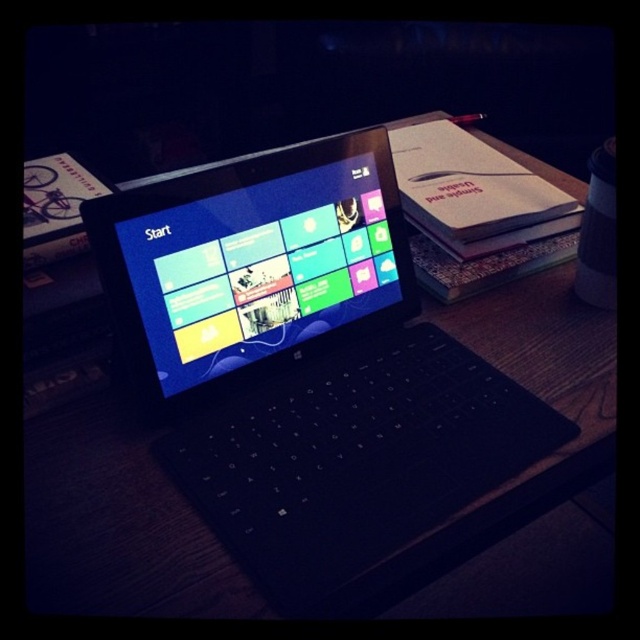
Who is higher up, black matte laptop at center or matte plastic screen at center?

matte plastic screen at center

What do you see at coordinates (304, 364) in the screenshot?
I see `black matte laptop at center` at bounding box center [304, 364].

Is point (228, 472) farther from viewer compared to point (321, 173)?

No, (228, 472) is closer to viewer.

I want to click on black matte laptop at center, so 304,364.